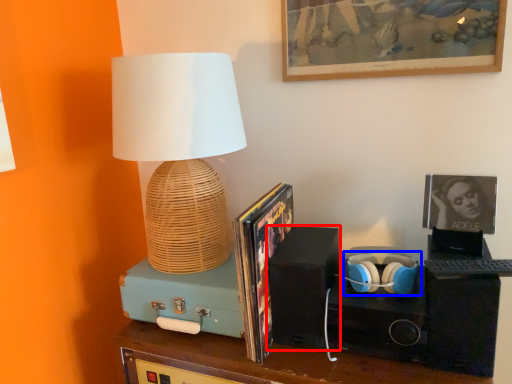
Question: Which object appears farthest to the camera in this image, speaker (highlighted by a red box) or headphones (highlighted by a blue box)?

Choices:
 (A) speaker
 (B) headphones

Answer: (A)